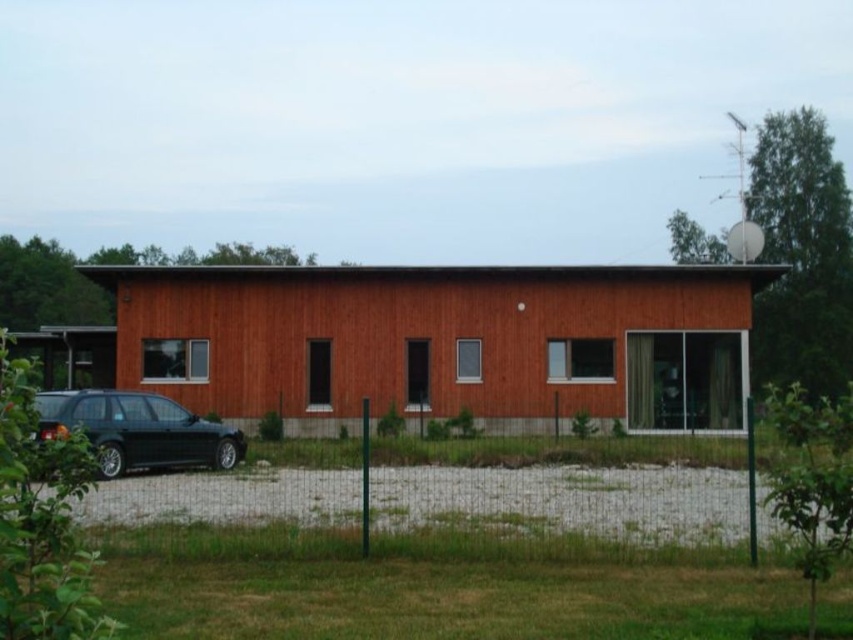
Between wooden barn at center and shiny dark gray car at lower left, which one is positioned higher?

wooden barn at center is above.

Between point (389, 404) and point (183, 448), which one is positioned in front?

Point (183, 448) is more forward.

Describe the element at coordinates (442, 340) in the screenshot. The image size is (853, 640). I see `wooden barn at center` at that location.

The width and height of the screenshot is (853, 640). In order to click on wooden barn at center in this screenshot , I will do `click(442, 340)`.